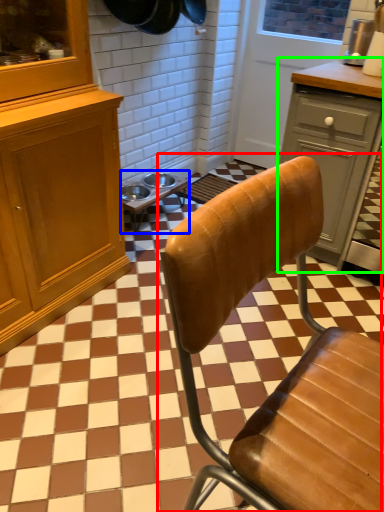
Question: Estimate the real-world distances between objects in this image. Which object is farther from chair (highlighted by a red box), table (highlighted by a blue box) or cabinetry (highlighted by a green box)?

Choices:
 (A) table
 (B) cabinetry

Answer: (A)